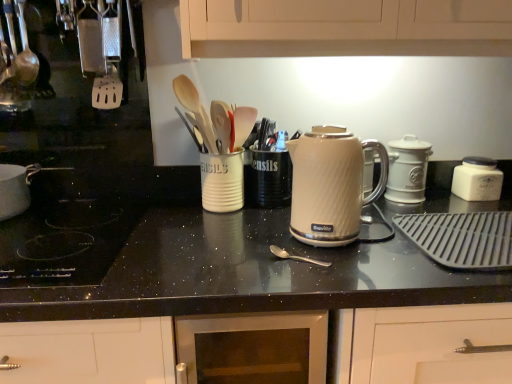
Question: Does point (389, 269) appear closer or farther from the camera than point (116, 104)?

Choices:
 (A) closer
 (B) farther

Answer: (A)

Question: Visually, is black granite countertop at center positioned to the left or to the right of white plastic spatula at left?

Choices:
 (A) left
 (B) right

Answer: (B)

Question: Which of these objects is positioned farthest from the white matte canister at right, which is the 2th kitchen appliance from left to right?

Choices:
 (A) cream matte electric kettle at center, which is counted as the first kitchen appliance, starting from the front
 (B) black glass cooktop at lower left
 (C) white plastic spatula at left
 (D) brushed metal spoon at upper left, which is counted as the first utensil, starting from the back
 (E) white ribbed mug at center

Answer: (D)

Question: Which is farther from the black glass cooktop at lower left?

Choices:
 (A) white matte canister at right, which is the 2th kitchen appliance from left to right
 (B) silver metallic spoon at center, the 2th utensil viewed from the back
 (C) white plastic spatula at left
 (D) black granite countertop at center
 (E) cream matte electric kettle at center, which is counted as the first kitchen appliance, starting from the front

Answer: (A)